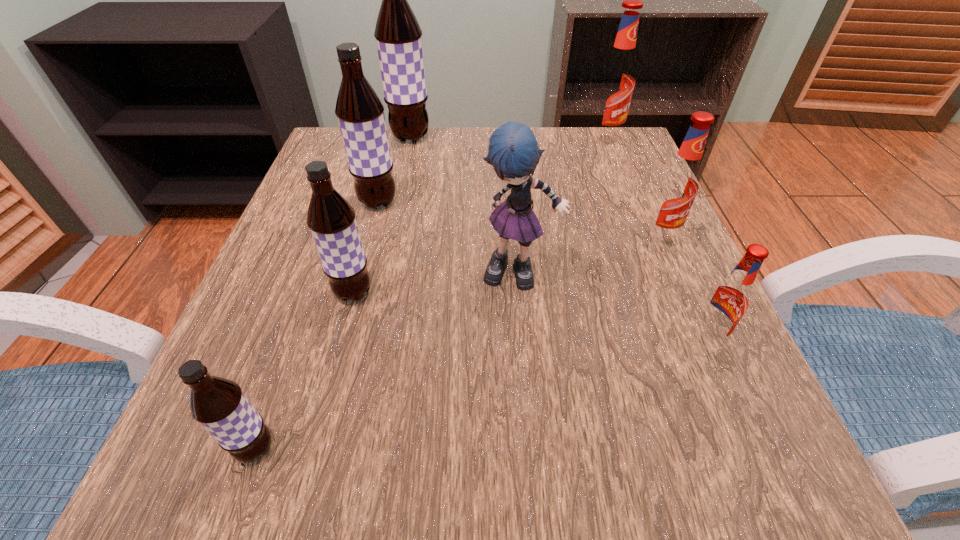
The image size is (960, 540). Identify the location of free space located on the front of the second smallest brown root beer. (335, 362).

Locate an element on the screen. This screenshot has width=960, height=540. vacant region located 0.280m on the left of the smallest red root beer is located at coordinates (504, 338).

At what (x,y) coordinates should I click in order to perform the action: click on free point located 0.130m on the back of the nearest root beer. Please return your answer as a coordinate pair (x, y). The image size is (960, 540). Looking at the image, I should click on (293, 345).

I want to click on object that is at the near edge, so click(218, 404).

At what (x,y) coordinates should I click in order to perform the action: click on object present at the far left corner. Please return your answer as a coordinate pair (x, y). Looking at the image, I should click on pyautogui.click(x=398, y=34).

Find the location of a particular element. Image resolution: width=960 pixels, height=540 pixels. object at the near left corner is located at coordinates (218, 404).

The height and width of the screenshot is (540, 960). I want to click on object that is at the far right corner, so click(616, 80).

I want to click on vacant space at the far edge of the desktop, so click(397, 179).

The image size is (960, 540). In the image, there is a desktop. Find the location of `vacant space at the near edge`. vacant space at the near edge is located at coordinates [x=510, y=509].

Identify the location of free space at the left edge of the desktop. (295, 254).